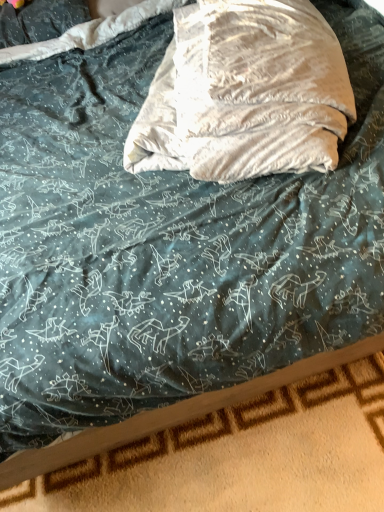
Question: In the image, is beige velvety throw pillow at center on the left side or the right side of wooden bed frame at bottom?

Choices:
 (A) left
 (B) right

Answer: (B)

Question: From the image's perspective, relative to wooden bed frame at bottom, is beige velvety throw pillow at center above or below?

Choices:
 (A) below
 (B) above

Answer: (B)

Question: Considering the positions of beige velvety throw pillow at center and wooden bed frame at bottom in the image, is beige velvety throw pillow at center taller or shorter than wooden bed frame at bottom?

Choices:
 (A) tall
 (B) short

Answer: (A)

Question: Considering the positions of wooden bed frame at bottom and beige velvety throw pillow at center in the image, is wooden bed frame at bottom bigger or smaller than beige velvety throw pillow at center?

Choices:
 (A) small
 (B) big

Answer: (A)

Question: Considering the positions of point (105, 470) and point (216, 42), is point (105, 470) closer or farther from the camera than point (216, 42)?

Choices:
 (A) farther
 (B) closer

Answer: (B)

Question: Which is correct: wooden bed frame at bottom is inside beige velvety throw pillow at center, or outside of it?

Choices:
 (A) outside
 (B) inside

Answer: (A)

Question: Considering their positions, is wooden bed frame at bottom located in front of or behind beige velvety throw pillow at center?

Choices:
 (A) behind
 (B) front

Answer: (A)